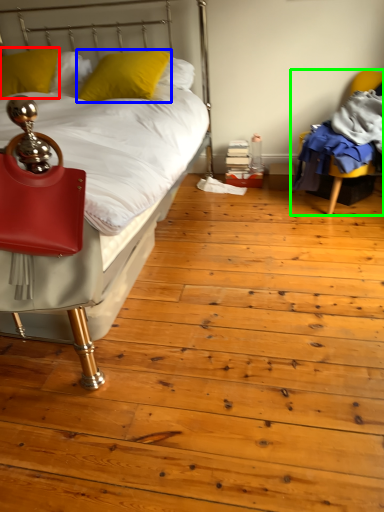
Question: Which object is the farthest from pillow (highlighted by a red box)? Choose among these: pillow (highlighted by a blue box) or chair (highlighted by a green box).

Choices:
 (A) pillow
 (B) chair

Answer: (B)